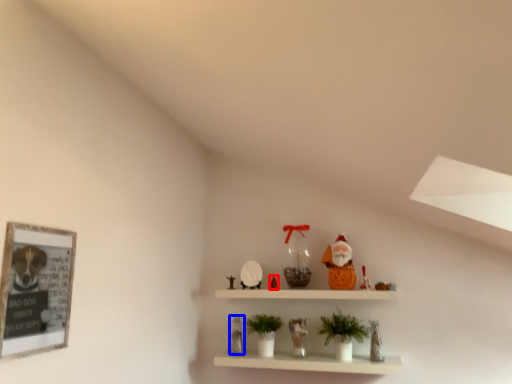
Question: Which point is closer to the camera, toy (highlighted by a red box) or toy (highlighted by a blue box)?

Choices:
 (A) toy
 (B) toy

Answer: (B)